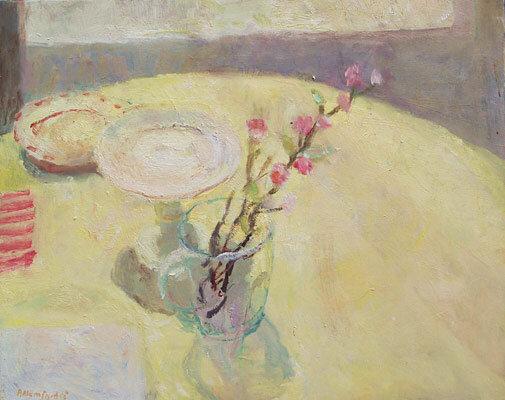
Find the location of `painted shadow from cake stand`. painted shadow from cake stand is located at coordinates (131, 268), (151, 286).